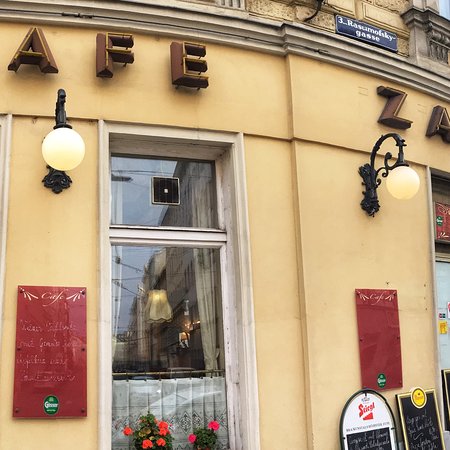
Locate an element on the screen. The image size is (450, 450). window is located at coordinates (173, 375).